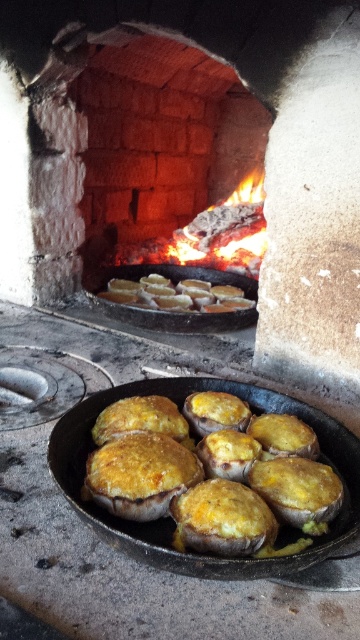
Question: Does charcoal wood fire at center appear under golden-brown crusty bread at center?

Choices:
 (A) yes
 (B) no

Answer: (B)

Question: Is golden-brown crusty mushroom caps at center closer to the viewer compared to charcoal wood fire at center?

Choices:
 (A) yes
 (B) no

Answer: (A)

Question: Which point is closer to the camera?

Choices:
 (A) (156, 248)
 (B) (149, 301)

Answer: (B)

Question: Estimate the real-world distances between objects in this image. Which object is closer to the golden-brown crusty bread at center?

Choices:
 (A) golden-brown crusty mushroom caps at center
 (B) charcoal wood fire at center

Answer: (B)

Question: Is charcoal wood fire at center above golden-brown crusty bread at center?

Choices:
 (A) yes
 (B) no

Answer: (A)

Question: Which is nearer to the golden-brown crusty mushroom caps at center?

Choices:
 (A) charcoal wood fire at center
 (B) golden-brown crusty bread at center

Answer: (B)